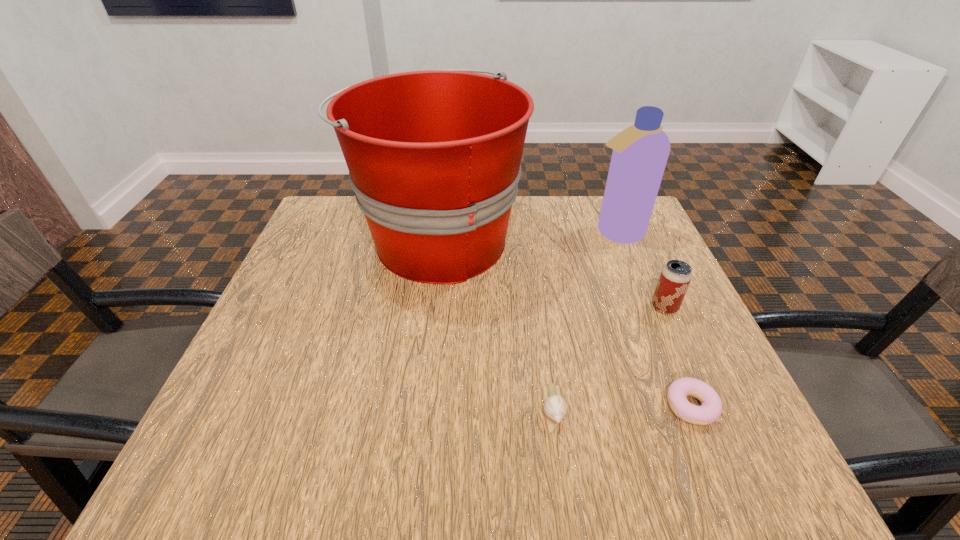
The width and height of the screenshot is (960, 540). I want to click on shampoo at the far edge, so click(640, 152).

At what (x,y) coordinates should I click in order to perform the action: click on escargot that is at the near edge. Please return your answer as a coordinate pair (x, y). Looking at the image, I should click on (555, 407).

Where is `doughnut at the near edge`? The width and height of the screenshot is (960, 540). doughnut at the near edge is located at coordinates (710, 410).

The width and height of the screenshot is (960, 540). I want to click on object that is positioned at the left edge, so click(x=434, y=157).

Where is `shampoo positioned at the right edge`? Image resolution: width=960 pixels, height=540 pixels. shampoo positioned at the right edge is located at coordinates pos(640,152).

The height and width of the screenshot is (540, 960). Find the location of `beer can that is at the right edge`. beer can that is at the right edge is located at coordinates (675, 277).

What are the coordinates of `doughnut present at the right edge` in the screenshot? It's located at (710, 410).

You are a GUI agent. You are given a task and a screenshot of the screen. Output one action in this format:
    pyautogui.click(x=<x>, y=<y>)
    Task: Click on the object at the far left corner
    Image resolution: width=960 pixels, height=540 pixels.
    Given the screenshot: What is the action you would take?
    pyautogui.click(x=434, y=157)

This screenshot has width=960, height=540. I want to click on object that is positioned at the far right corner, so click(x=640, y=152).

Locate an element on the screen. The image size is (960, 540). object that is at the near right corner is located at coordinates (710, 410).